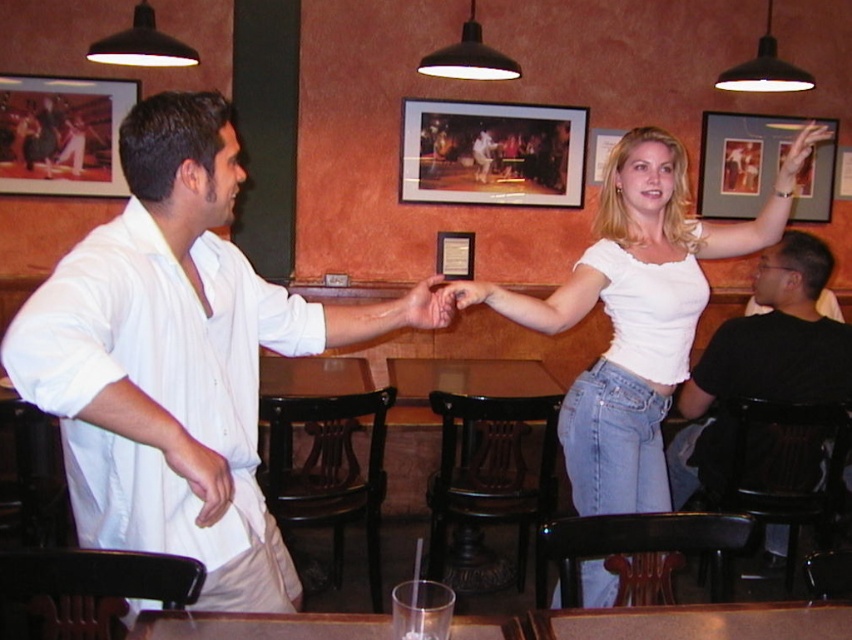
You are an interior designer assessing the space for a new piece of furniture. You have a small table that is the same size as the matte wooden picture frame at center. Will the table fit in the space where the black cotton shirt at right is currently located?

The black cotton shirt at right is bigger than the matte wooden picture frame at center. Since the table is the same size as the matte wooden picture frame at center, it will fit in the space where the black cotton shirt at right is located.

You are a photographer trying to capture a candid shot of the white cotton shirt at center without including the matte black picture frame at upper right in the background. Is this possible given their positions?

Yes, the white cotton shirt at center is positioned in front of the matte black picture frame at upper right, so by focusing on the shirt and adjusting the camera angle slightly, it should be possible to exclude the frame from the shot.